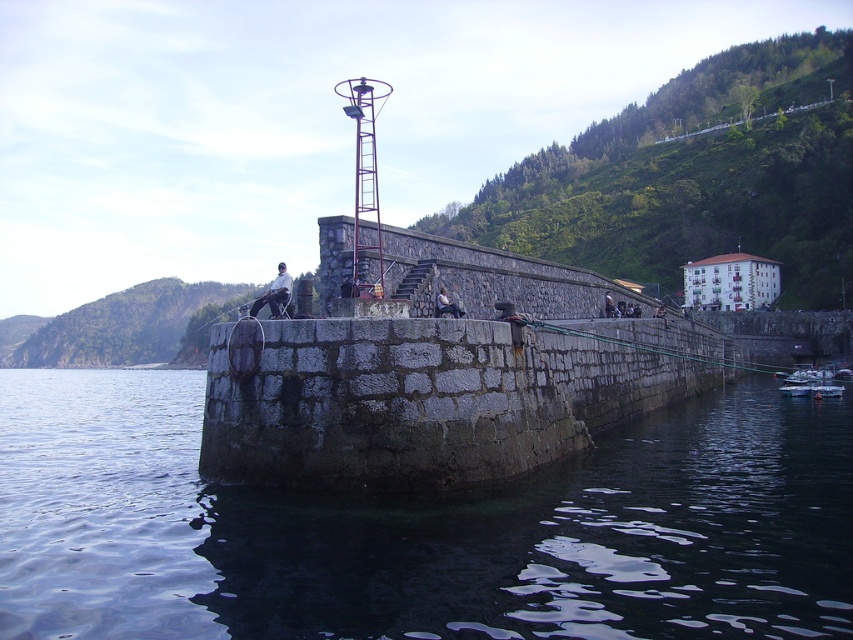
Question: Does dark blue water at lower left appear on the left side of white fabric at center?

Choices:
 (A) yes
 (B) no

Answer: (A)

Question: Considering the real-world distances, which object is closest to the white fabric at center?

Choices:
 (A) dark gray fabric jacket at center
 (B) dark gray stone person at center
 (C) dark blue water at lower left

Answer: (A)

Question: Which of the following is the farthest from the observer?

Choices:
 (A) dark blue water at lower left
 (B) metallic gray boat at lower right
 (C) dark gray stone person at center

Answer: (B)

Question: Does metallic gray boat at lower right appear on the left side of dark gray stone person at center?

Choices:
 (A) no
 (B) yes

Answer: (A)

Question: Which object is farther from the camera taking this photo?

Choices:
 (A) dark blue water at lower left
 (B) dark gray fabric jacket at center
 (C) metallic gray boat at lower right

Answer: (C)

Question: Is dark blue water at lower left positioned in front of dark gray fabric jacket at center?

Choices:
 (A) yes
 (B) no

Answer: (A)